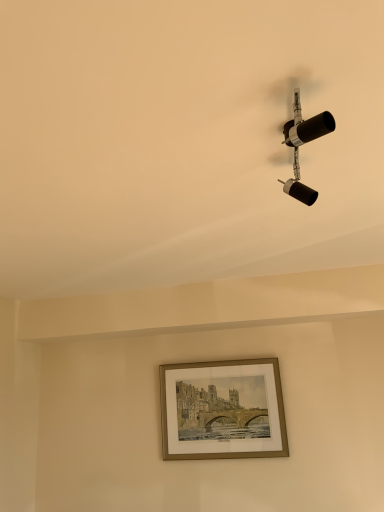
The image size is (384, 512). What do you see at coordinates (302, 144) in the screenshot? I see `matte black spotlight at upper right` at bounding box center [302, 144].

The image size is (384, 512). I want to click on matte black spotlight at upper right, so click(x=302, y=144).

This screenshot has height=512, width=384. What do you see at coordinates (222, 410) in the screenshot?
I see `gold metallic picture frame at center` at bounding box center [222, 410].

Find the location of a particular element. gold metallic picture frame at center is located at coordinates (222, 410).

Where is `matte black spotlight at upper right`? The image size is (384, 512). matte black spotlight at upper right is located at coordinates click(302, 144).

Considering the positions of objects gold metallic picture frame at center and matte black spotlight at upper right in the image provided, who is more to the left, gold metallic picture frame at center or matte black spotlight at upper right?

From the viewer's perspective, gold metallic picture frame at center appears more on the left side.

Is gold metallic picture frame at center closer to camera compared to matte black spotlight at upper right?

No, gold metallic picture frame at center is behind matte black spotlight at upper right.

Which is nearer, (212, 434) or (314, 191)?

The point (314, 191) is closer.

From the picture: From the image's perspective, would you say gold metallic picture frame at center is positioned over matte black spotlight at upper right?

Incorrect, from the image's perspective, gold metallic picture frame at center is lower than matte black spotlight at upper right.

From a real-world perspective, which object stands above the other?

matte black spotlight at upper right, from a real-world perspective.

Looking at this image, considering the sizes of objects gold metallic picture frame at center and matte black spotlight at upper right in the image provided, who is thinner, gold metallic picture frame at center or matte black spotlight at upper right?

gold metallic picture frame at center is thinner.

Considering the sizes of objects gold metallic picture frame at center and matte black spotlight at upper right in the image provided, who is taller, gold metallic picture frame at center or matte black spotlight at upper right?

gold metallic picture frame at center is taller.

Does gold metallic picture frame at center have a smaller size compared to matte black spotlight at upper right?

No, gold metallic picture frame at center is not smaller than matte black spotlight at upper right.

Based on the photo, is gold metallic picture frame at center located outside matte black spotlight at upper right?

That's correct, gold metallic picture frame at center is outside of matte black spotlight at upper right.

Are gold metallic picture frame at center and matte black spotlight at upper right located far from each other?

That's right, there is a large distance between gold metallic picture frame at center and matte black spotlight at upper right.

Is gold metallic picture frame at center oriented towards matte black spotlight at upper right?

Yes, gold metallic picture frame at center is turned towards matte black spotlight at upper right.

Identify the location of lamp located on the right of gold metallic picture frame at center. (302, 144).

Which is more to the left, matte black spotlight at upper right or gold metallic picture frame at center?

gold metallic picture frame at center is more to the left.

Which is behind, matte black spotlight at upper right or gold metallic picture frame at center?

gold metallic picture frame at center is further from the camera.

Which is in front, point (313, 202) or point (241, 421)?

The point (313, 202) is closer.

From the image's perspective, would you say matte black spotlight at upper right is positioned over gold metallic picture frame at center?

Yes.

From a real-world perspective, is matte black spotlight at upper right positioned above or below gold metallic picture frame at center?

matte black spotlight at upper right is above gold metallic picture frame at center.

Is matte black spotlight at upper right wider or thinner than gold metallic picture frame at center?

In the image, matte black spotlight at upper right appears to be wider than gold metallic picture frame at center.

Can you confirm if matte black spotlight at upper right is shorter than gold metallic picture frame at center?

Indeed, matte black spotlight at upper right has a lesser height compared to gold metallic picture frame at center.

From the picture: Based on their sizes in the image, would you say matte black spotlight at upper right is bigger or smaller than gold metallic picture frame at center?

In the image, matte black spotlight at upper right appears to be smaller than gold metallic picture frame at center.

Do you think matte black spotlight at upper right is within gold metallic picture frame at center, or outside of it?

matte black spotlight at upper right is spatially situated outside gold metallic picture frame at center.

Is matte black spotlight at upper right positioned far away from gold metallic picture frame at center?

matte black spotlight at upper right is positioned a significant distance from gold metallic picture frame at center.

Does matte black spotlight at upper right turn towards gold metallic picture frame at center?

No.

Can you tell me how much matte black spotlight at upper right and gold metallic picture frame at center differ in facing direction?

88.8 degrees separate the facing orientations of matte black spotlight at upper right and gold metallic picture frame at center.

At what (x,y) coordinates should I click in order to perform the action: click on picture frame that appears behind the matte black spotlight at upper right. Please return your answer as a coordinate pair (x, y). The image size is (384, 512). Looking at the image, I should click on (222, 410).

This screenshot has height=512, width=384. There is a gold metallic picture frame at center. What are the coordinates of `lamp above it (from a real-world perspective)` in the screenshot? It's located at (302, 144).

You are a GUI agent. You are given a task and a screenshot of the screen. Output one action in this format:
    pyautogui.click(x=<x>, y=<y>)
    Task: Click on the lamp on the right of gold metallic picture frame at center
    
    Given the screenshot: What is the action you would take?
    pyautogui.click(x=302, y=144)